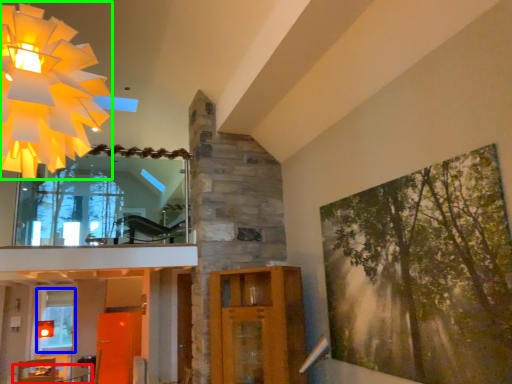
Question: Estimate the real-world distances between objects in this image. Which object is farther from table (highlighted by a red box), window (highlighted by a blue box) or chandelier (highlighted by a green box)?

Choices:
 (A) window
 (B) chandelier

Answer: (B)